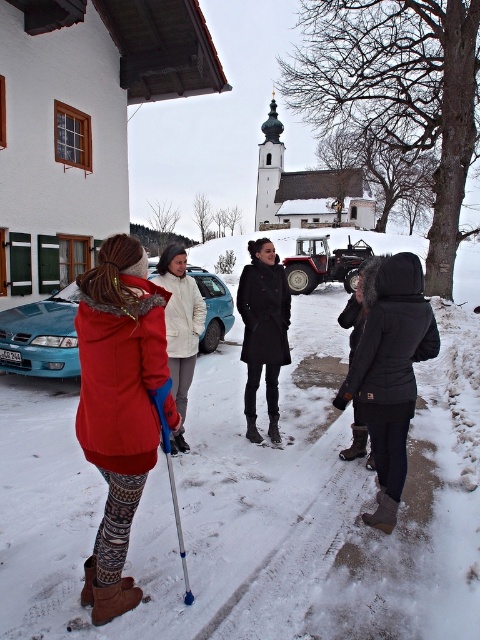
Question: Which is farther from the black matte coat at center?

Choices:
 (A) white matte coat at center
 (B) red fleece jacket at lower left
 (C) black synthetic jacket at lower right

Answer: (B)

Question: Does black synthetic jacket at lower right appear under metallic blue ski pole at lower center?

Choices:
 (A) yes
 (B) no

Answer: (B)

Question: Can you confirm if black matte coat at center is bigger than metallic blue ski pole at lower center?

Choices:
 (A) yes
 (B) no

Answer: (A)

Question: Does black synthetic jacket at lower right appear over metallic blue ski pole at lower center?

Choices:
 (A) yes
 (B) no

Answer: (A)

Question: Which point appears closest to the camera in this image?

Choices:
 (A) (267, 284)
 (B) (392, 390)

Answer: (B)

Question: Which object is farther from the camera taking this photo?

Choices:
 (A) white matte coat at center
 (B) black synthetic jacket at lower right
 (C) red fleece jacket at lower left
 (D) black matte coat at center

Answer: (D)